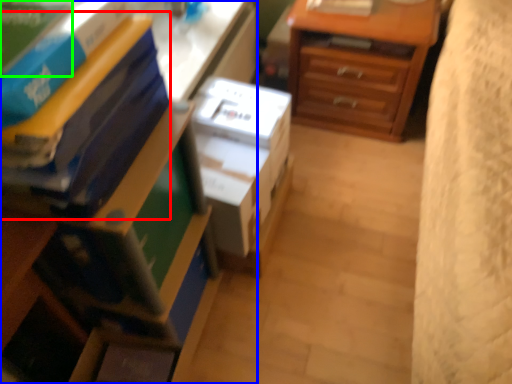
Question: Which is nearer to the paperback book (highlighted by a red box)? nightstand (highlighted by a blue box) or paperback book (highlighted by a green box).

Choices:
 (A) nightstand
 (B) paperback book

Answer: (A)